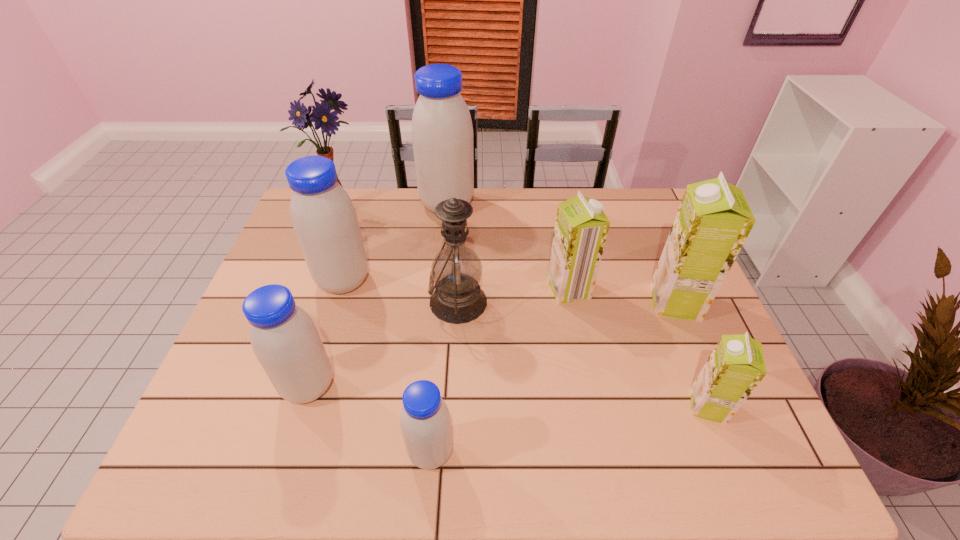
Identify which object is the sixth closest to the oil lamp. Please provide its 2D coordinates. Your answer should be formatted as a tuple, i.e. [(x, y)], where the tuple contains the x and y coordinates of a point satisfying the conditions above.

[(321, 115)]

Identify the location of the fifth closest object to the third farthest blue soya milk. (581, 227).

Locate which soya milk is the closest to the nearest blue soya milk. Please provide its 2D coordinates. Your answer should be formatted as a tuple, i.e. [(x, y)], where the tuple contains the x and y coordinates of a point satisfying the conditions above.

[(285, 340)]

Identify the location of the third closest soya milk relative to the biggest green soya milk. (442, 133).

Identify which blue soya milk is the third closest to the second biggest blue soya milk. Please provide its 2D coordinates. Your answer should be formatted as a tuple, i.e. [(x, y)], where the tuple contains the x and y coordinates of a point satisfying the conditions above.

[(425, 422)]

The image size is (960, 540). Identify the location of blue soya milk object that ranks as the closest to the biggest green soya milk. point(442,133).

Identify which green soya milk is the closest to the gray oil lamp. Please provide its 2D coordinates. Your answer should be formatted as a tuple, i.e. [(x, y)], where the tuple contains the x and y coordinates of a point satisfying the conditions above.

[(581, 227)]

This screenshot has height=540, width=960. What are the coordinates of `green soya milk that is the nearest to the nearest green soya milk` in the screenshot? It's located at (713, 221).

At what (x,y) coordinates should I click in order to perform the action: click on free space that satisfies the following two spatial constraints: 1. on the front side of the leftmost green soya milk; 2. on the left side of the purple flower arrangement. Please return your answer as a coordinate pair (x, y). Looking at the image, I should click on [x=310, y=289].

This screenshot has width=960, height=540. In order to click on vacant region that satisfies the following two spatial constraints: 1. on the front side of the biggest blue soya milk; 2. on the left side of the oil lamp in this screenshot , I will do `click(439, 302)`.